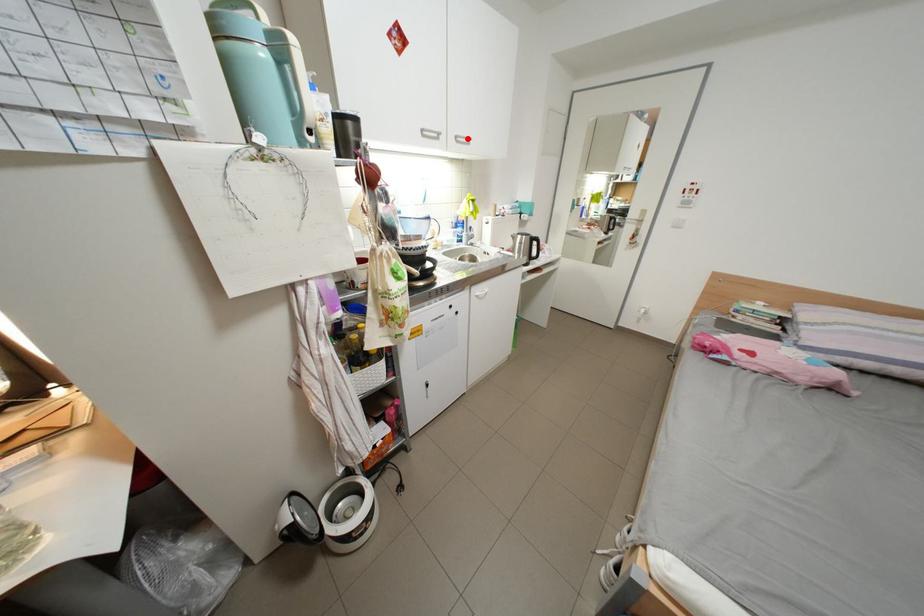
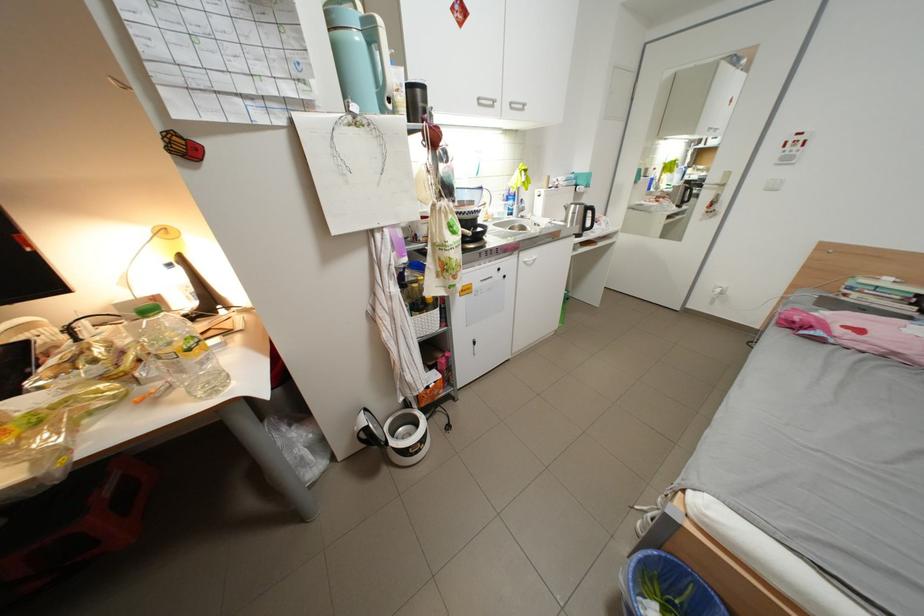
Locate, in the second image, the point that corresponds to the highlighted location in the first image.

(523, 105)